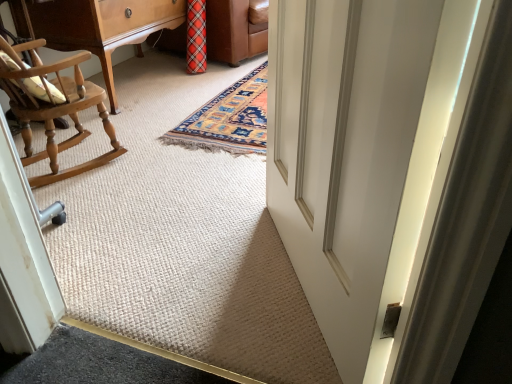
Question: Is white smooth door at center to the left or to the right of wooden rocking chair at left in the image?

Choices:
 (A) left
 (B) right

Answer: (B)

Question: From the image's perspective, relative to wooden rocking chair at left, is white smooth door at center above or below?

Choices:
 (A) below
 (B) above

Answer: (A)

Question: Is white smooth door at center spatially inside wooden rocking chair at left, or outside of it?

Choices:
 (A) outside
 (B) inside

Answer: (A)

Question: From the image's perspective, is wooden rocking chair at left located above or below white smooth door at center?

Choices:
 (A) below
 (B) above

Answer: (B)

Question: In the image, is wooden rocking chair at left on the left side or the right side of white smooth door at center?

Choices:
 (A) right
 (B) left

Answer: (B)

Question: Do you think wooden rocking chair at left is within white smooth door at center, or outside of it?

Choices:
 (A) inside
 (B) outside

Answer: (B)

Question: Looking at the image, does wooden rocking chair at left seem bigger or smaller compared to white smooth door at center?

Choices:
 (A) big
 (B) small

Answer: (A)